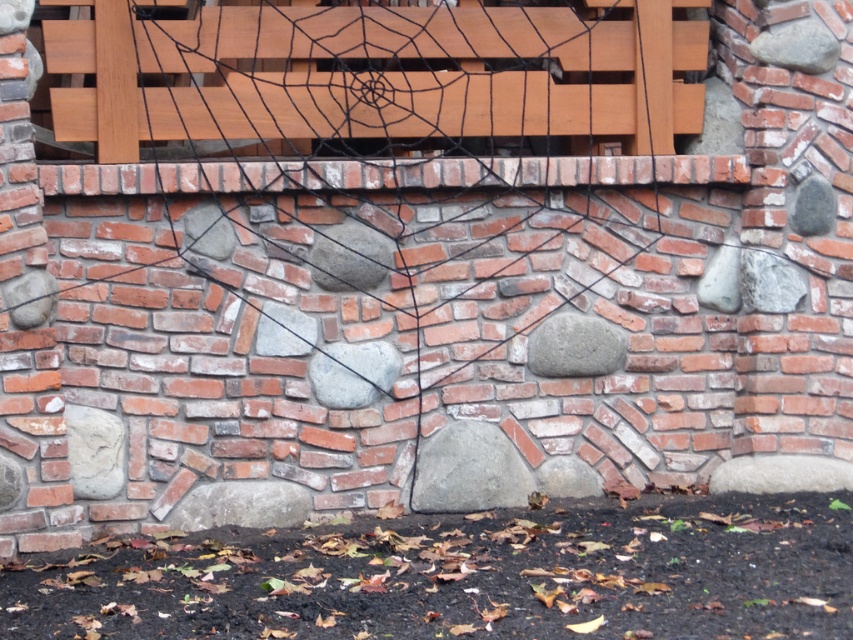
Can you confirm if black netting spider web at center is positioned to the right of gray matte rock at center?

Incorrect, black netting spider web at center is not on the right side of gray matte rock at center.

Consider the image. Between black netting spider web at center and gray matte rock at center, which one is positioned higher?

black netting spider web at center

You are a GUI agent. You are given a task and a screenshot of the screen. Output one action in this format:
    pyautogui.click(x=<x>, y=<y>)
    Task: Click on the black netting spider web at center
    Image resolution: width=853 pixels, height=640 pixels.
    Given the screenshot: What is the action you would take?
    pyautogui.click(x=395, y=250)

Based on the photo, is the position of matte wooden bench at upper center more distant than that of gray matte rock at center?

No.

From the picture: Is matte wooden bench at upper center to the right of gray matte rock at center from the viewer's perspective?

Incorrect, matte wooden bench at upper center is not on the right side of gray matte rock at center.

Is point (248, 16) closer to viewer compared to point (566, 372)?

Yes.

In order to click on matte wooden bench at upper center in this screenshot , I will do `click(376, 76)`.

Is black netting spider web at center bigger than matte wooden bench at upper center?

Indeed, black netting spider web at center has a larger size compared to matte wooden bench at upper center.

Does black netting spider web at center appear over matte wooden bench at upper center?

No.

Between point (322, 84) and point (152, 49), which one is positioned behind?

Positioned behind is point (322, 84).

At what (x,y) coordinates should I click in order to perform the action: click on black netting spider web at center. Please return your answer as a coordinate pair (x, y). The image size is (853, 640). Looking at the image, I should click on (395, 250).